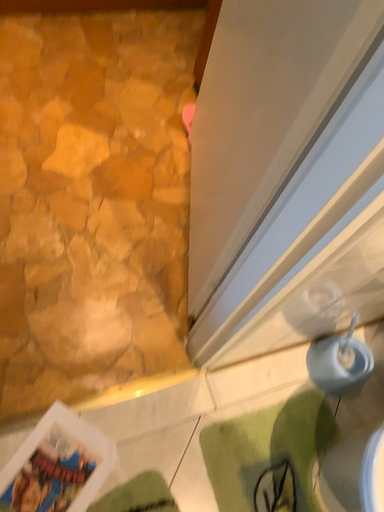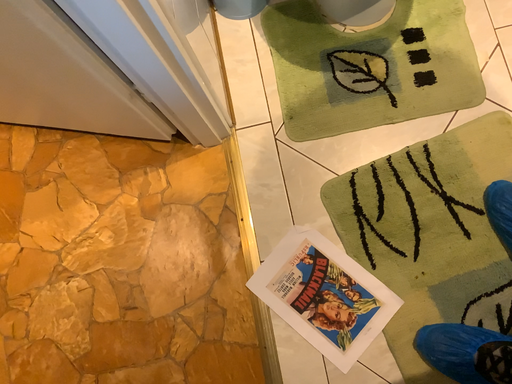
Question: How did the camera likely rotate when shooting the video?

Choices:
 (A) rotated left
 (B) rotated right

Answer: (B)